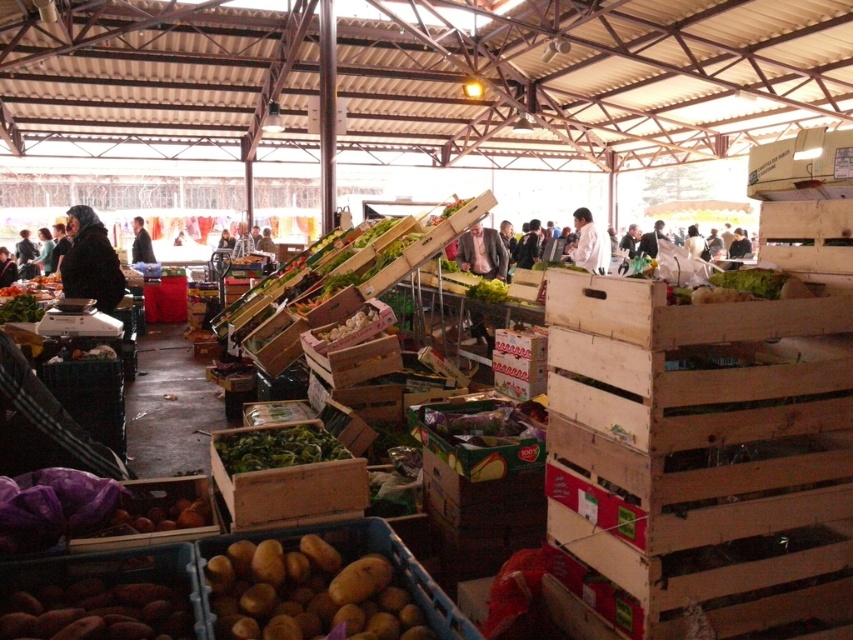
Looking at this image, between matte gray suit at center and white fabric at center, which one appears on the right side from the viewer's perspective?

From the viewer's perspective, white fabric at center appears more on the right side.

Locate an element on the screen. The width and height of the screenshot is (853, 640). matte gray suit at center is located at coordinates (482, 252).

Who is positioned more to the left, matte gray suit at center or dark gray sweater at left?

dark gray sweater at left

Is matte gray suit at center to the left of dark gray sweater at left from the viewer's perspective?

No, matte gray suit at center is not to the left of dark gray sweater at left.

Is point (461, 252) positioned after point (38, 264)?

No, it is in front of (38, 264).

This screenshot has width=853, height=640. I want to click on matte gray suit at center, so click(482, 252).

Which is behind, point (115, 305) or point (469, 248)?

Positioned behind is point (469, 248).

Is black fabric at left smaller than matte gray suit at center?

Actually, black fabric at left might be larger than matte gray suit at center.

Is point (73, 292) in front of point (473, 236)?

Yes.

Find the location of `black fabric at left`. black fabric at left is located at coordinates (90, 260).